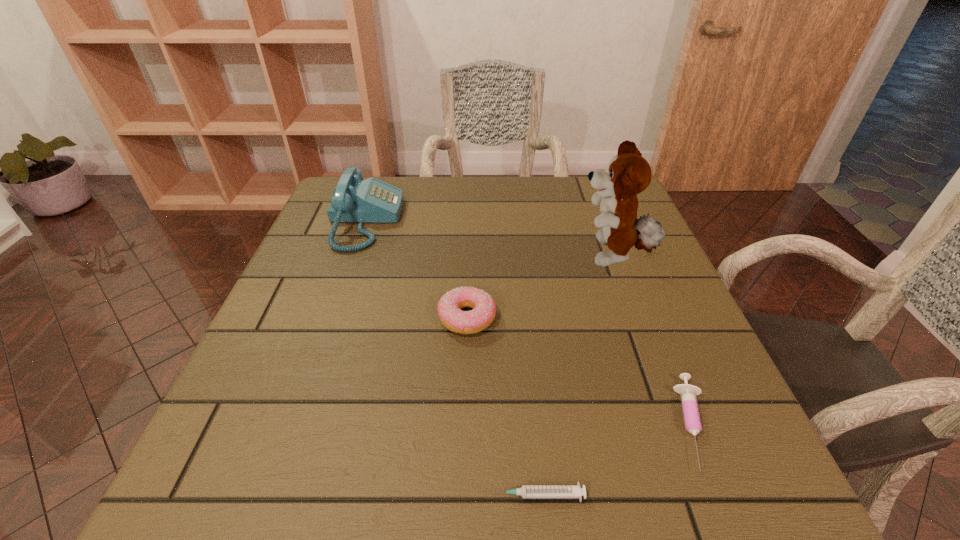
Locate an element on the screen. free space that satisfies the following two spatial constraints: 1. on the front side of the doughnut; 2. on the left side of the fourth farthest object is located at coordinates (464, 424).

Locate an element on the screen. The height and width of the screenshot is (540, 960). vacant space that satisfies the following two spatial constraints: 1. on the face of the right syringe; 2. on the left side of the puppy is located at coordinates (673, 424).

Find the location of `vacant region that satisfies the following two spatial constraints: 1. on the dial of the taller syringe; 2. on the left side of the fourth shortest object`. vacant region that satisfies the following two spatial constraints: 1. on the dial of the taller syringe; 2. on the left side of the fourth shortest object is located at coordinates (294, 424).

This screenshot has height=540, width=960. In order to click on free space that satisfies the following two spatial constraints: 1. on the face of the tallest object; 2. on the front side of the third farthest object in this screenshot , I will do `click(635, 318)`.

In order to click on free region that satisfies the following two spatial constraints: 1. on the face of the puppy; 2. on the left side of the farther syringe in this screenshot , I will do `click(673, 424)`.

You are a GUI agent. You are given a task and a screenshot of the screen. Output one action in this format:
    pyautogui.click(x=<x>, y=<y>)
    Task: Click on the free spot that satisfies the following two spatial constraints: 1. on the back side of the second nearest object; 2. on the dial of the telephone
    
    Given the screenshot: What is the action you would take?
    612,221